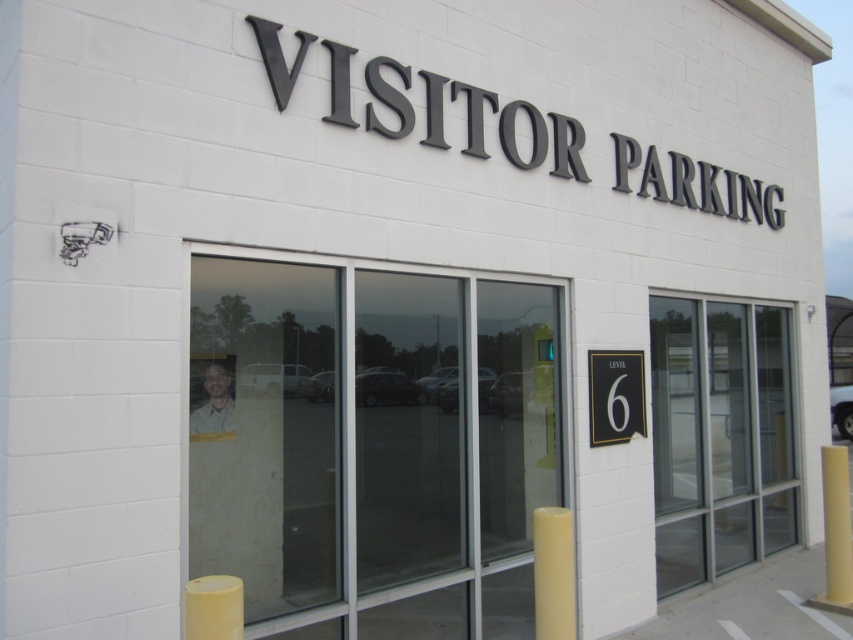
Which is more to the left, transparent glass door at center or yellow matte/soft pillar at lower right?

Positioned to the left is transparent glass door at center.

Looking at this image, can you confirm if transparent glass door at center is bigger than yellow matte/soft pillar at lower right?

Incorrect, transparent glass door at center is not larger than yellow matte/soft pillar at lower right.

Is point (462, 449) farther from camera compared to point (554, 524)?

Yes, point (462, 449) is farther from viewer.

You are a GUI agent. You are given a task and a screenshot of the screen. Output one action in this format:
    pyautogui.click(x=<x>, y=<y>)
    Task: Click on the transparent glass door at center
    The height and width of the screenshot is (640, 853).
    Given the screenshot: What is the action you would take?
    pyautogui.click(x=374, y=444)

Can you confirm if yellow matte pole at right is positioned below light brown shirt at lower left?

Yes.

Does yellow matte pole at right appear on the right side of light brown shirt at lower left?

Yes, yellow matte pole at right is to the right of light brown shirt at lower left.

What do you see at coordinates (836, 529) in the screenshot? I see `yellow matte pole at right` at bounding box center [836, 529].

Identify the location of yellow matte pole at right. The height and width of the screenshot is (640, 853). (836, 529).

Is black plastic sign at center taller than light brown shirt at lower left?

Correct, black plastic sign at center is much taller as light brown shirt at lower left.

Does black plastic sign at center appear under light brown shirt at lower left?

Indeed, black plastic sign at center is positioned under light brown shirt at lower left.

Image resolution: width=853 pixels, height=640 pixels. I want to click on black plastic sign at center, so (x=614, y=396).